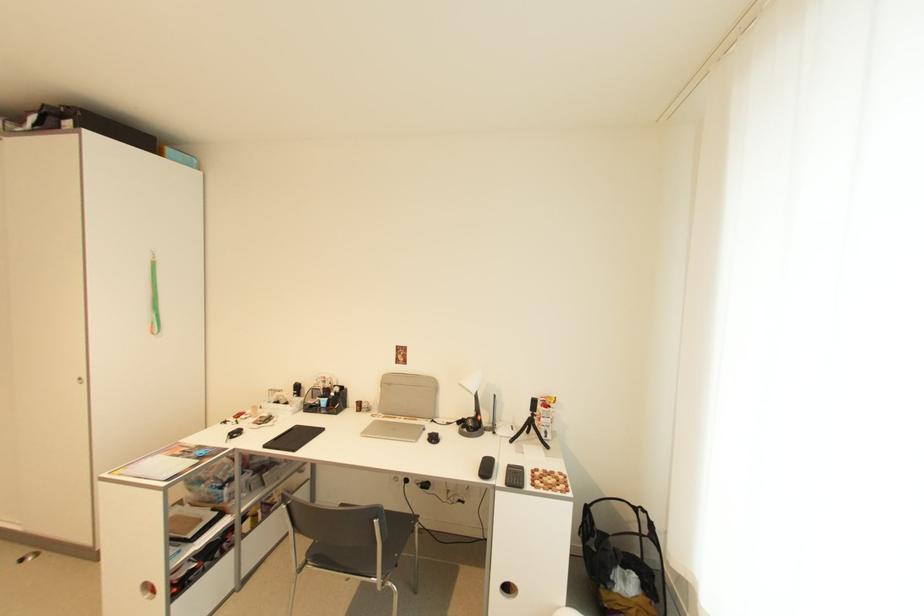
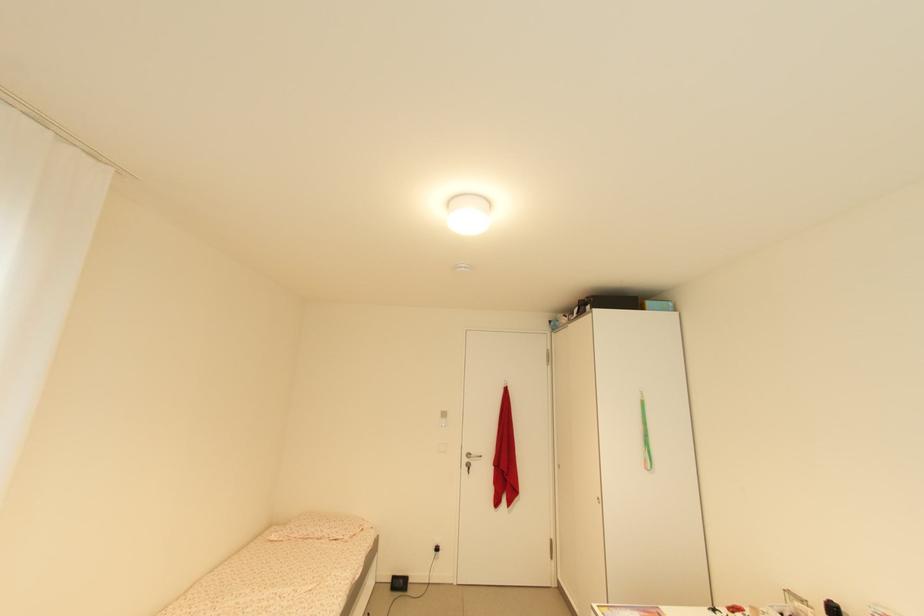
In the second image, find the point that corresponds to [174,152] in the first image.

(652, 304)